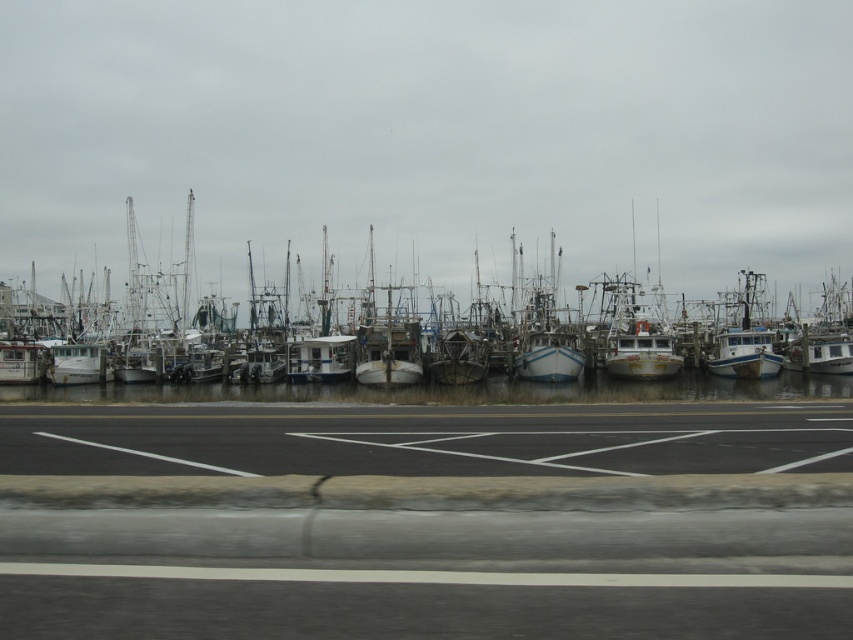
Question: Does black asphalt parking lot at center come behind white matte boat at center?

Choices:
 (A) yes
 (B) no

Answer: (B)

Question: Among these points, which one is nearest to the camera?

Choices:
 (A) (160, 477)
 (B) (27, 294)

Answer: (A)

Question: Among these points, which one is nearest to the camera?

Choices:
 (A) (286, 326)
 (B) (505, 477)

Answer: (B)

Question: Which point is closer to the camera?

Choices:
 (A) (444, 609)
 (B) (132, 323)

Answer: (A)

Question: Does black asphalt parking lot at center have a greater width compared to white matte boat at center?

Choices:
 (A) no
 (B) yes

Answer: (A)

Question: Does black asphalt parking lot at center have a smaller size compared to white matte boat at center?

Choices:
 (A) no
 (B) yes

Answer: (B)